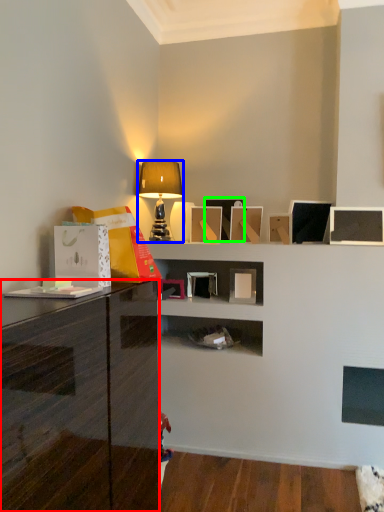
Question: Which object is the closest to the cabinetry (highlighted by a red box)? Choose among these: lamp (highlighted by a blue box) or picture frame (highlighted by a green box).

Choices:
 (A) lamp
 (B) picture frame

Answer: (A)